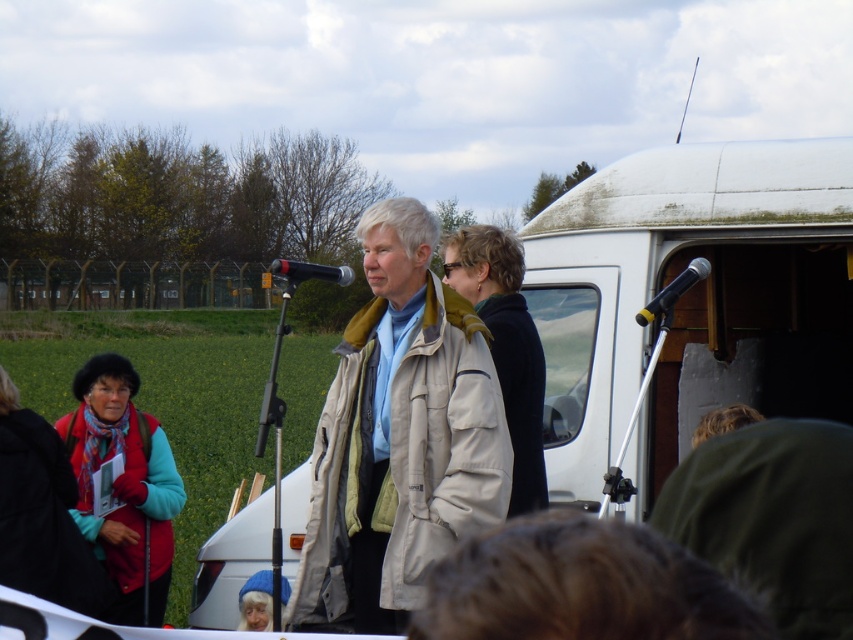
Question: Is beige fabric coat at center to the right of metallic silver microphone at upper right from the viewer's perspective?

Choices:
 (A) yes
 (B) no

Answer: (B)

Question: Can you confirm if beige fabric coat at center is positioned to the left of matte red vest at left?

Choices:
 (A) no
 (B) yes

Answer: (A)

Question: Can you confirm if matte red vest at left is wider than metallic silver microphone at upper right?

Choices:
 (A) no
 (B) yes

Answer: (B)

Question: Which of these objects is positioned closest to the metallic silver microphone at upper right?

Choices:
 (A) matte black microphone at center
 (B) matte red vest at left
 (C) beige fabric coat at center

Answer: (C)

Question: Based on their relative distances, which object is nearer to the matte black microphone at center?

Choices:
 (A) beige fabric coat at center
 (B) metallic silver microphone at upper right

Answer: (B)

Question: Based on their relative distances, which object is nearer to the matte black microphone at center?

Choices:
 (A) beige fabric coat at center
 (B) metallic silver microphone at upper right

Answer: (B)